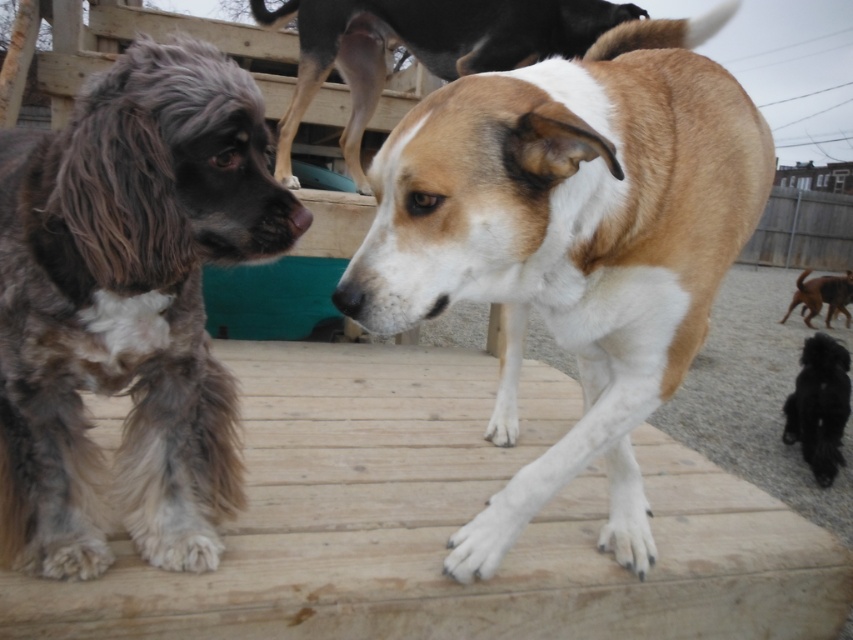
Which of these two, brown/white fur dog at center or brown/white fur dog at upper center, stands shorter?

With less height is brown/white fur dog at upper center.

Is point (549, 257) positioned behind point (550, 28)?

No, (549, 257) is closer to viewer.

The width and height of the screenshot is (853, 640). I want to click on brown/white fur dog at center, so click(572, 243).

Between gray fluffy dog at left and brown/white fur dog at upper center, which one has more height?

With more height is gray fluffy dog at left.

In order to click on gray fluffy dog at left in this screenshot , I will do `click(128, 307)`.

Locate an element on the screen. The width and height of the screenshot is (853, 640). gray fluffy dog at left is located at coordinates (128, 307).

Does wooden deck at center come in front of brown/white fur dog at upper center?

Yes, wooden deck at center is closer to the viewer.

Identify the location of wooden deck at center. (445, 524).

The image size is (853, 640). I want to click on wooden deck at center, so click(x=445, y=524).